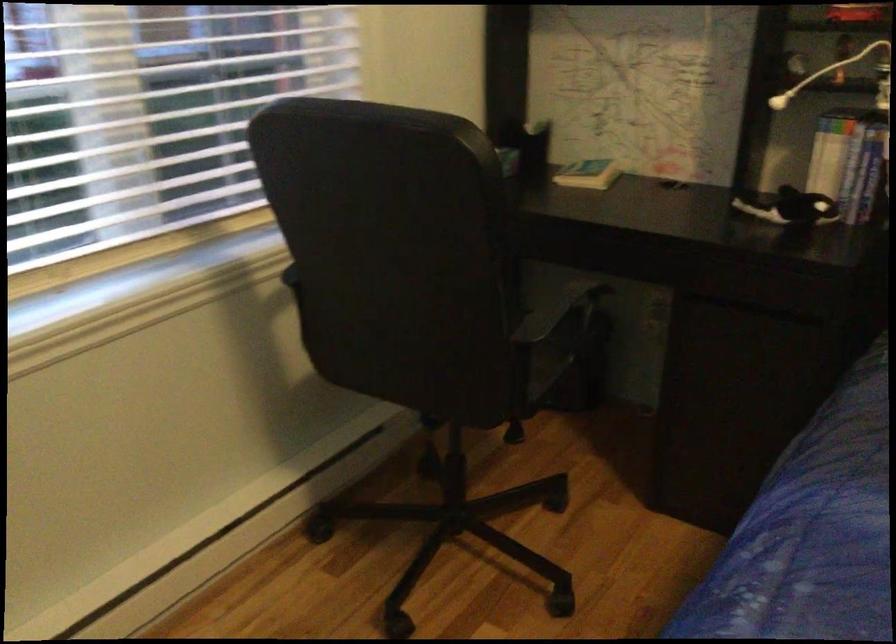
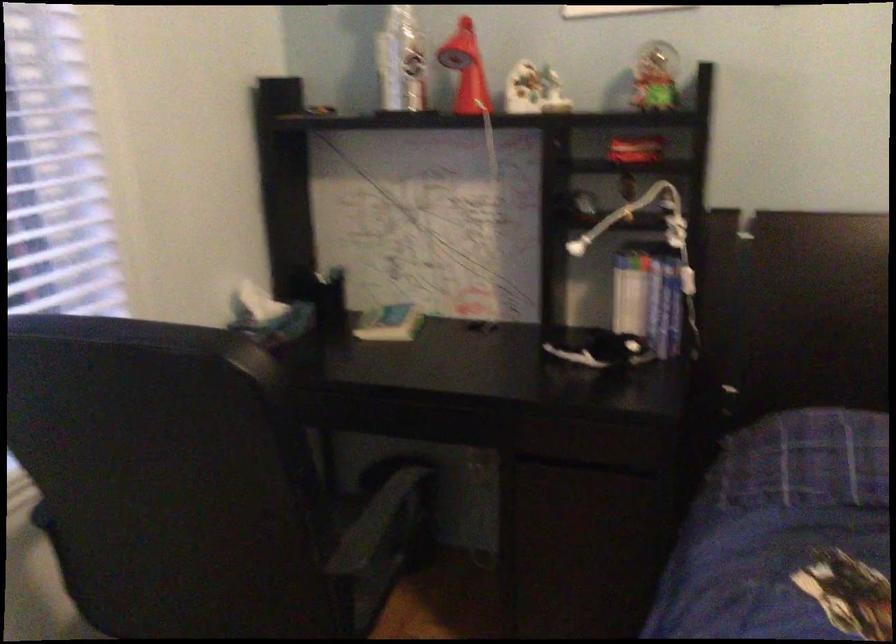
Where in the second image is the point corresponding to pixel 778 100 from the first image?

(576, 247)